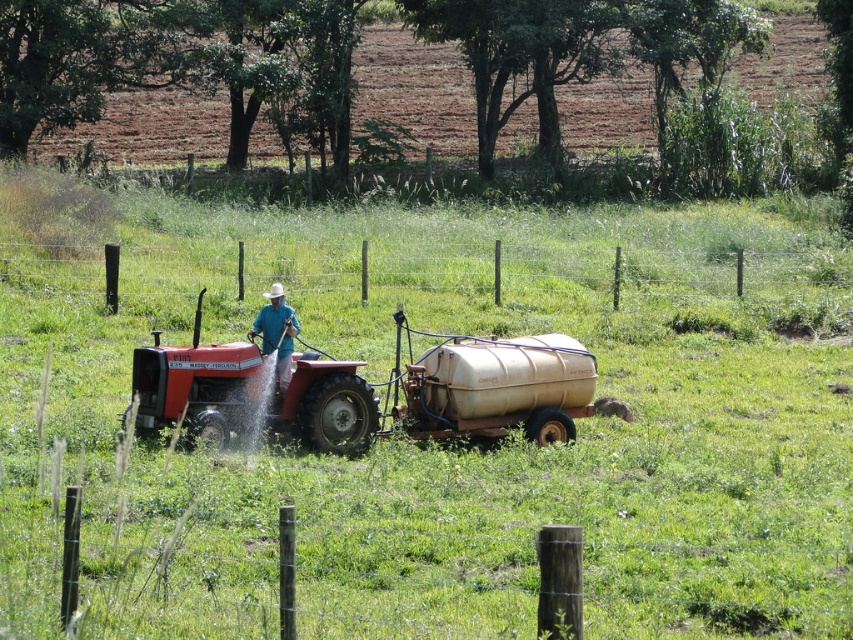
Does green grass at center have a larger size compared to matte red tractor at center?

Correct, green grass at center is larger in size than matte red tractor at center.

Can you confirm if green grass at center is thinner than matte red tractor at center?

No.

Who is more distant from viewer, (422, 294) or (142, 428)?

The point (422, 294) is behind.

The image size is (853, 640). Identify the location of green grass at center. (433, 442).